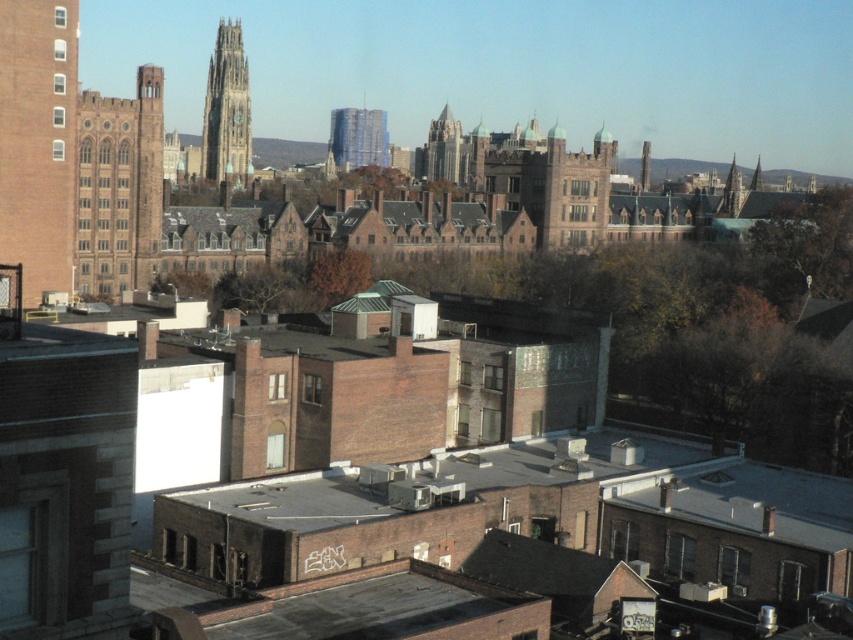
Question: Is brown stone tower at left to the right of gold stone tower at upper left from the viewer's perspective?

Choices:
 (A) yes
 (B) no

Answer: (A)

Question: From the image, what is the correct spatial relationship of brick tower at left in relation to dark gray stone tower at upper center?

Choices:
 (A) below
 (B) above

Answer: (A)

Question: Which of the following is the closest to the observer?

Choices:
 (A) brick tower at left
 (B) gold stone tower at upper left
 (C) brown stone tower at left

Answer: (A)

Question: Which point appears closest to the camera in this image?

Choices:
 (A) (447, 115)
 (B) (64, 212)
 (C) (230, 58)

Answer: (B)

Question: Can you confirm if brown stone tower at left is bigger than gold stone tower at upper left?

Choices:
 (A) no
 (B) yes

Answer: (A)

Question: Estimate the real-world distances between objects in this image. Which object is closer to the brown stone tower at left?

Choices:
 (A) gold stone tower at upper left
 (B) blue glass building at center

Answer: (A)